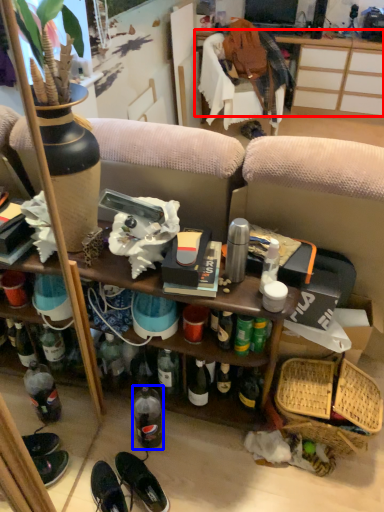
Question: Which object is further to the camera taking this photo, desk (highlighted by a red box) or bottle (highlighted by a blue box)?

Choices:
 (A) desk
 (B) bottle

Answer: (A)